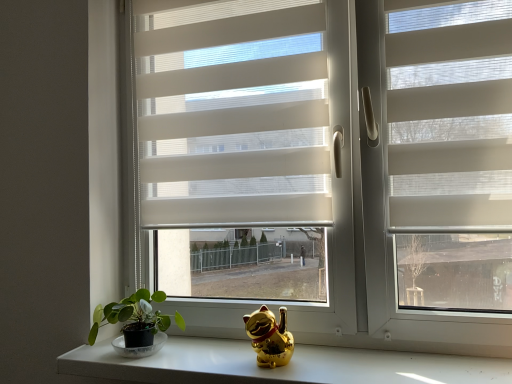
This screenshot has height=384, width=512. What are the coordinates of `spots to the right of green matte plant at lower left` in the screenshot? It's located at (207, 356).